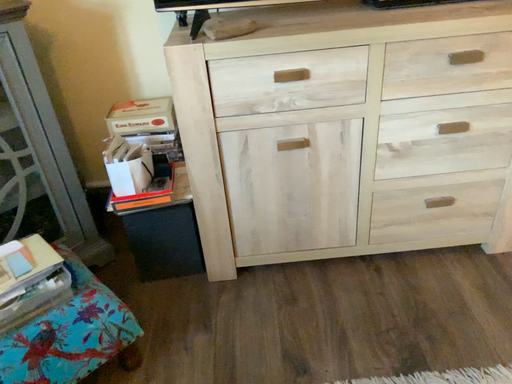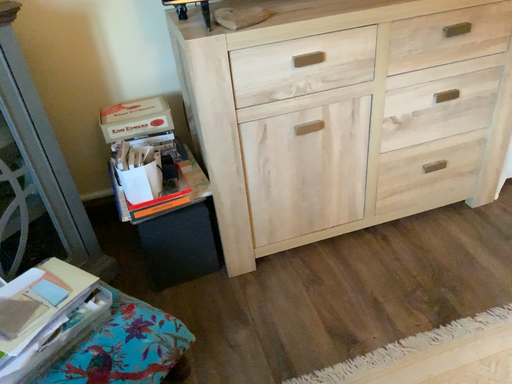
Question: Which way did the camera rotate in the video?

Choices:
 (A) rotated right
 (B) rotated left

Answer: (A)